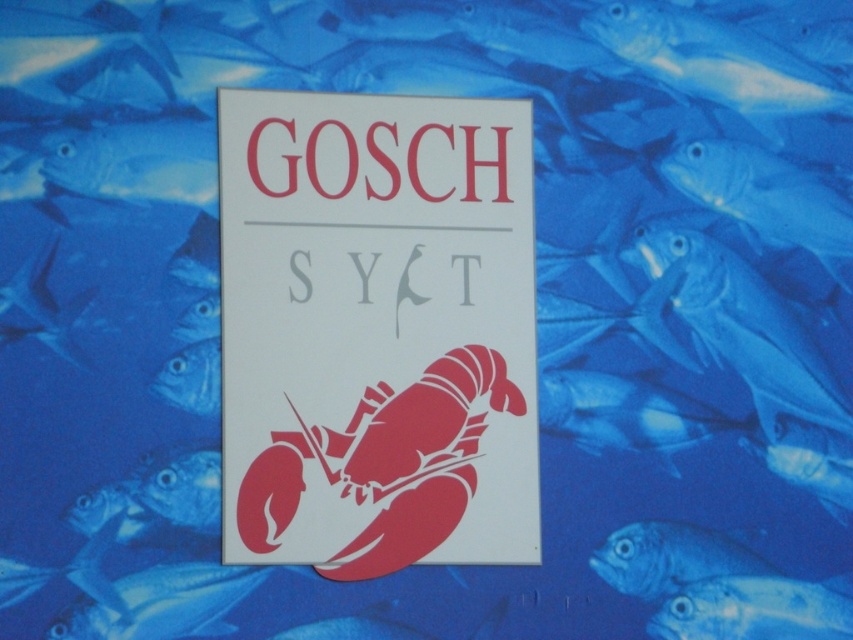
You are an underwater photographer aiming to capture the blue glossy fish at center. Based on its position coordinates, where should you aim your camera?

The blue glossy fish at center is located at coordinates point (671, 557), so you should aim your camera at that specific point to capture it.

You are a photographer holding a camera with a 2.5 meter focal length. You want to capture the blue glossy fish at center in focus while keeping the background sharp. Can you achieve this with your current camera settings?

The blue glossy fish at center is 3.55 meters away from the camera. Since the camera has a 2.5 meter focal length, the depth of field might be insufficient to keep both the fish and the background in focus simultaneously. You may need to adjust your aperture or use a different lens to achieve the desired focus range.

You are an underwater explorer looking at the central graphic design. There is a point at coordinates (x=376, y=332). Can you tell me what object this point is located on?

The point at coordinates (x=376, y=332) is on the white paper sign at center.